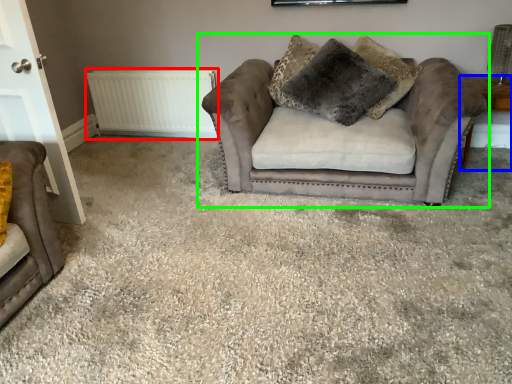
Question: Estimate the real-world distances between objects in this image. Which object is closer to radiator (highlighted by a red box), side table (highlighted by a blue box) or studio couch (highlighted by a green box)?

Choices:
 (A) side table
 (B) studio couch

Answer: (B)